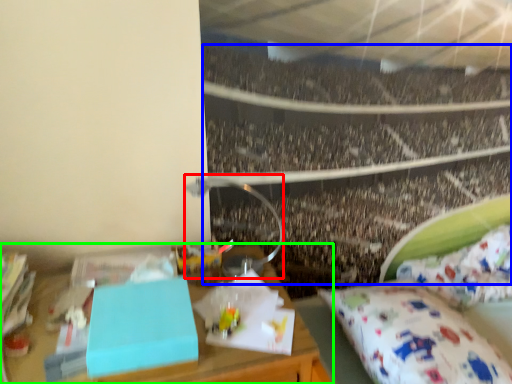
Question: Which is farther away from lamp (highlighted by a red box)? crowd (highlighted by a blue box) or desk (highlighted by a green box)?

Choices:
 (A) crowd
 (B) desk

Answer: (A)